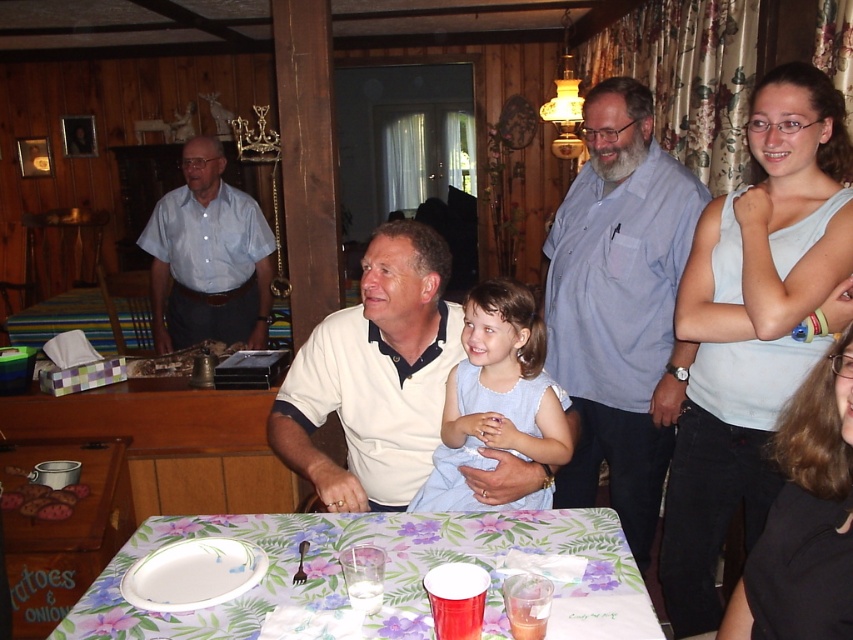
Question: Which point is farther from the camera taking this photo?

Choices:
 (A) (401, 260)
 (B) (410, 612)

Answer: (A)

Question: Estimate the real-world distances between objects in this image. Which object is closer to the floral printed tablecloth at lower center?

Choices:
 (A) light blue fabric dress at center
 (B) blue cotton shirt at center
 (C) white cotton shirt at center
 (D) light blue tank top at upper right

Answer: (A)

Question: Is light blue tank top at upper right behind blue cotton shirt at center?

Choices:
 (A) yes
 (B) no

Answer: (B)

Question: Does floral printed tablecloth at lower center have a greater width compared to white cotton shirt at center?

Choices:
 (A) no
 (B) yes

Answer: (B)

Question: Which point is closer to the camera?

Choices:
 (A) light blue fabric dress at center
 (B) light blue shirt at upper left
 (C) floral printed tablecloth at lower center
 (D) blue cotton shirt at center

Answer: (C)

Question: Is white cotton shirt at center wider than black fabric shirt at lower right?

Choices:
 (A) yes
 (B) no

Answer: (A)